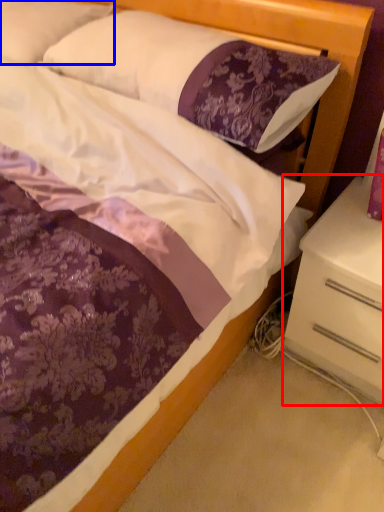
Question: Which point is further to the camera, nightstand (highlighted by a red box) or pillow (highlighted by a blue box)?

Choices:
 (A) nightstand
 (B) pillow

Answer: (B)